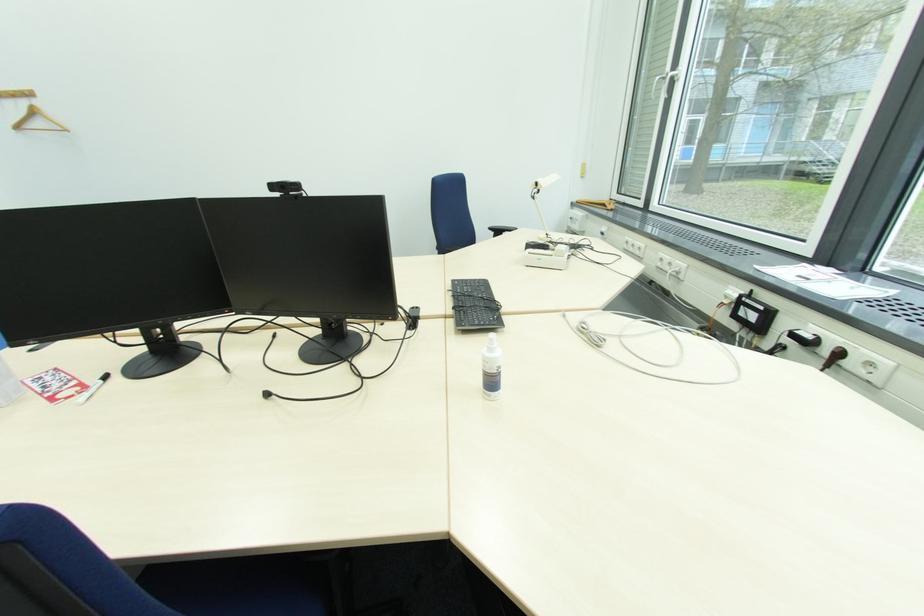
What do you see at coordinates (672, 79) in the screenshot?
I see `the white window handle` at bounding box center [672, 79].